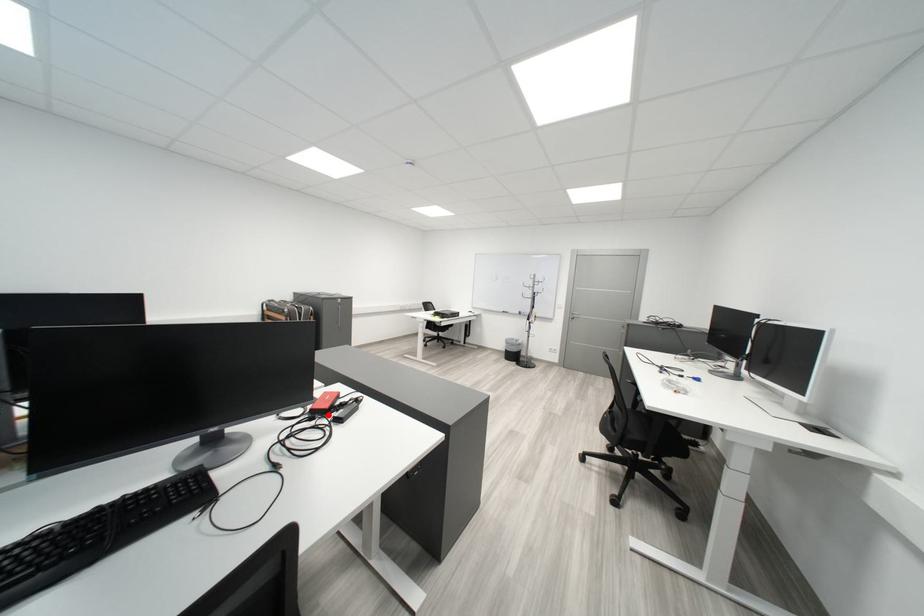
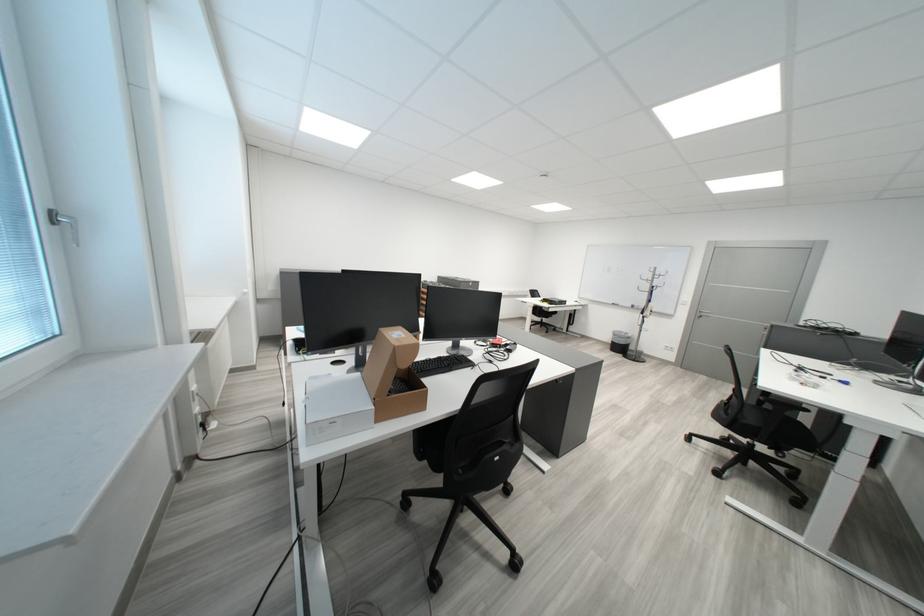
Find the pixel in the second image that matches the highlighted location in the first image.

(507, 347)